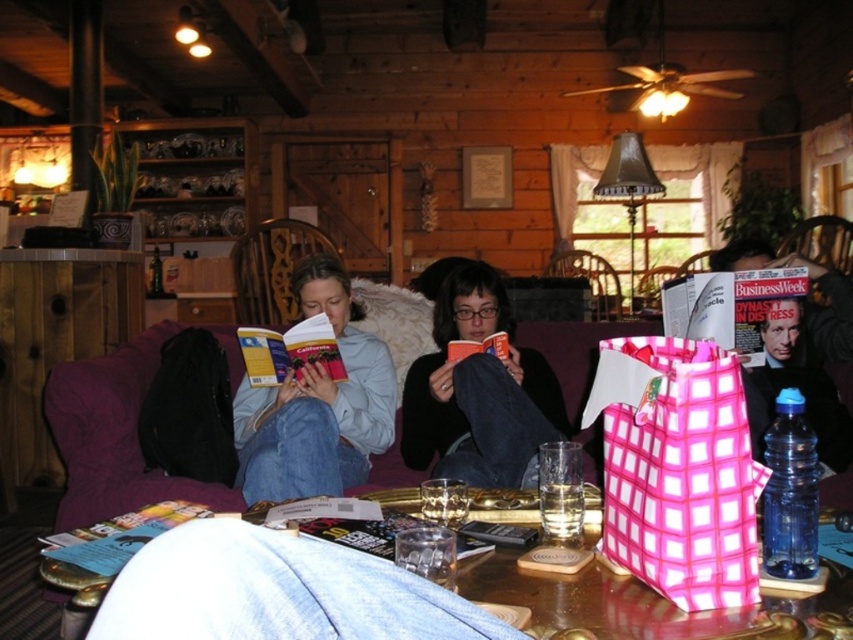
Consider the image. You are organizing a small party in the living room and need to place a decorative item on the tallest object between the blue paper book at lower left and the pink checkered fabric armchair at center. Which object should you choose?

The pink checkered fabric armchair at center is taller than the blue paper book at lower left, so you should place the decorative item on the pink checkered fabric armchair at center.

You are sitting on a couch in the cabin and want to pick up both the black matte sweater at center and the yellow paper book at center from the coffee table. Which item will you need to reach for first to grab the one that is closer to you?

The black matte sweater at center is closer to the viewer than the yellow paper book at center, so you should reach for the black matte sweater at center first.

You are a delivery robot that is 1.5 meters long. You need to move from the wooden armchair at upper right to the hardcover book at center. Is there enough space for you to move directly between them?

The distance between the wooden armchair at upper right and the hardcover book at center is 2.01 meters. Since the robot is 1.5 meters long, there is sufficient space for it to move directly between them as the distance is greater than the robot length.